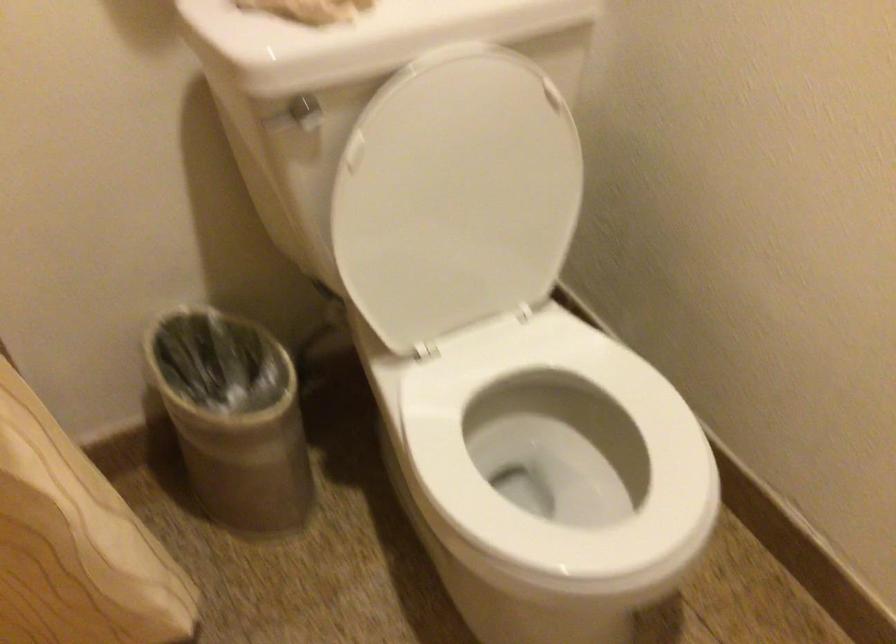
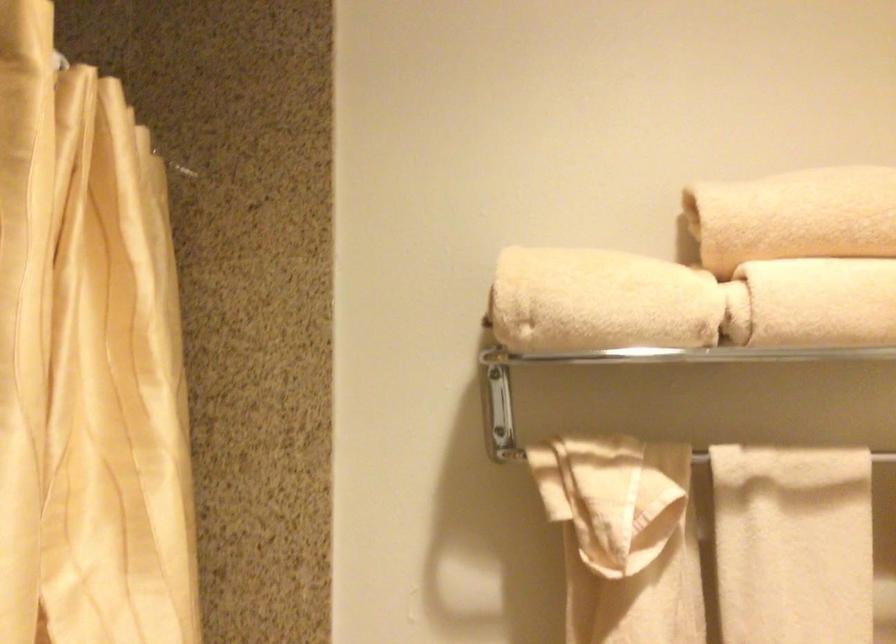
The first image is from the beginning of the video and the second image is from the end. How did the camera likely rotate when shooting the video?

The camera's rotation is toward left-up.